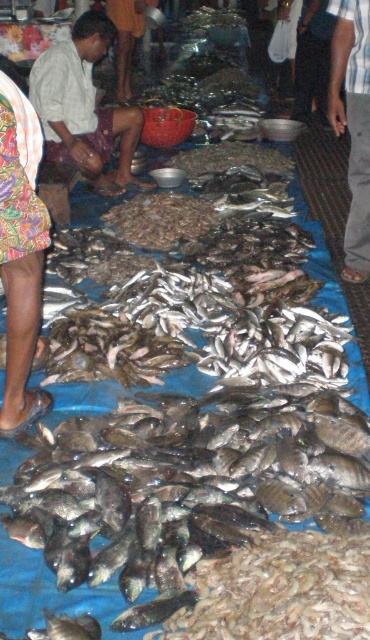
Question: Which object appears farthest from the camera in this image?

Choices:
 (A) printed fabric skirt at lower left
 (B) striped shirt at center

Answer: (B)

Question: Which of the following is the closest to the observer?

Choices:
 (A) printed fabric skirt at lower left
 (B) striped shirt at center

Answer: (A)

Question: Based on their relative distances, which object is nearer to the striped shirt at center?

Choices:
 (A) shiny dark fish at center
 (B) printed fabric skirt at lower left
 (C) brown woven cloth at left

Answer: (C)

Question: Does shiny dark fish at center have a greater width compared to brown woven cloth at left?

Choices:
 (A) yes
 (B) no

Answer: (A)

Question: Can you confirm if shiny dark fish at center is positioned above striped shirt at center?

Choices:
 (A) yes
 (B) no

Answer: (B)

Question: In this image, where is shiny dark fish at center located relative to striped shirt at center?

Choices:
 (A) left
 (B) right

Answer: (A)